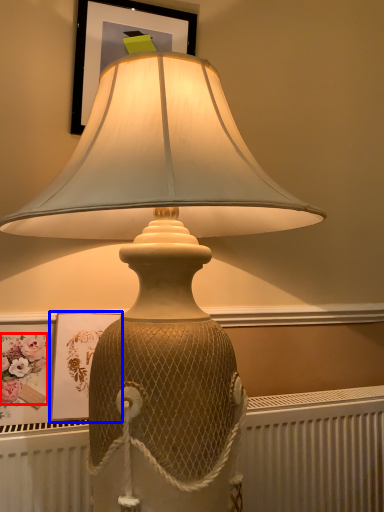
Question: Which of the following is the closest to the observer, flower (highlighted by a red box) or picture frame (highlighted by a blue box)?

Choices:
 (A) flower
 (B) picture frame

Answer: (A)